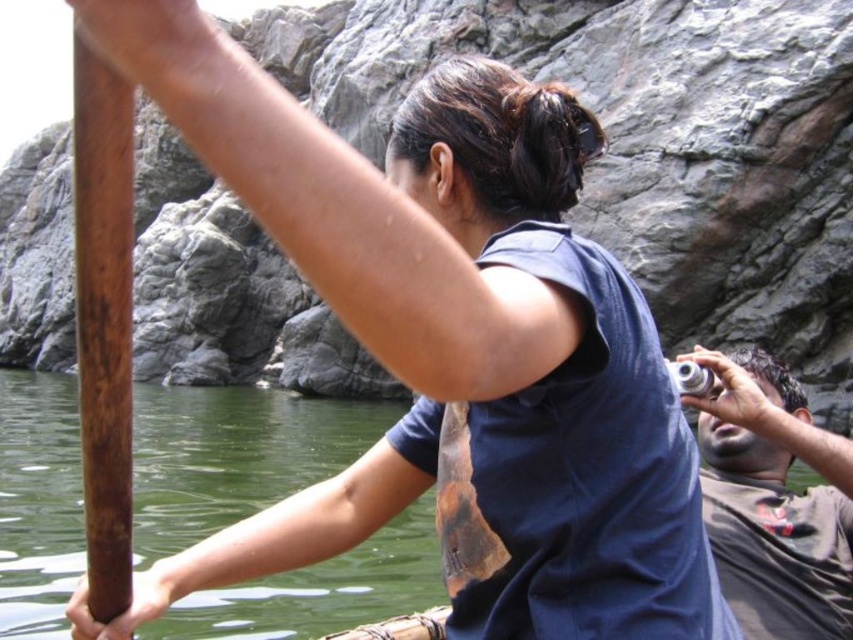
Consider the image. Who is lower down, dark brown leather camera at right or brown wooden pole at left?

Positioned lower is dark brown leather camera at right.

Who is shorter, dark brown leather camera at right or brown wooden pole at left?

dark brown leather camera at right is shorter.

Measure the distance between dark brown leather camera at right and camera.

23.09 meters

Identify the location of dark brown leather camera at right. (773, 500).